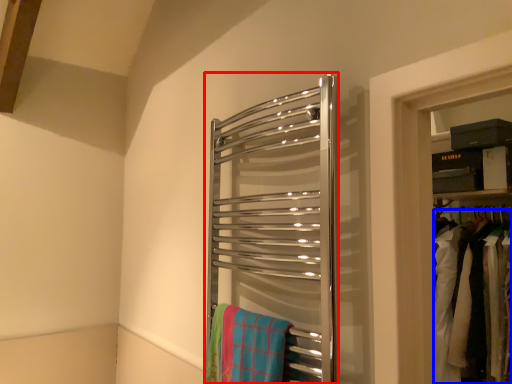
Question: Among these objects, which one is nearest to the camera, towel rack (highlighted by a red box) or laundry (highlighted by a blue box)?

Choices:
 (A) towel rack
 (B) laundry

Answer: (A)